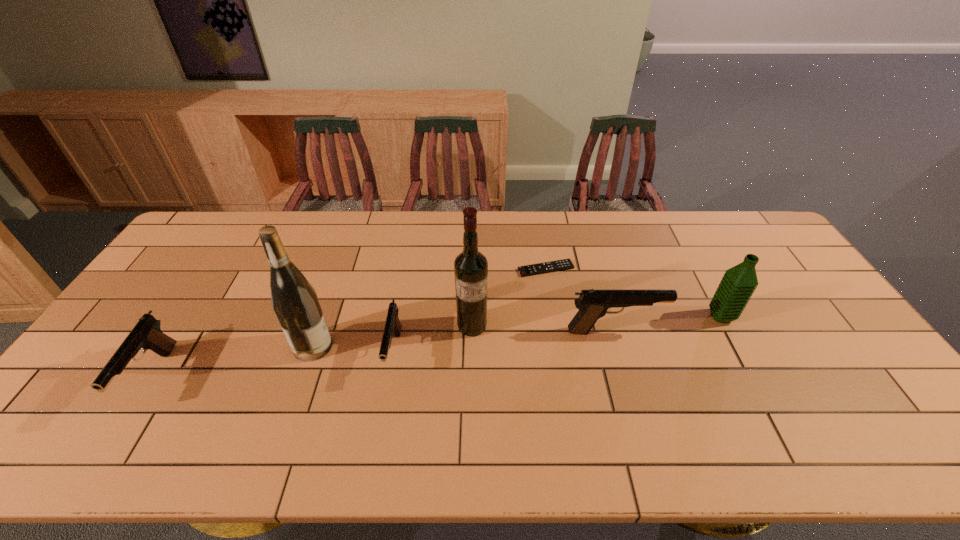
Locate an element on the screen. free spot that satisfies the following two spatial constraints: 1. at the muzzle of the rightmost pistol; 2. at the muzzle of the leftmost object is located at coordinates point(628,377).